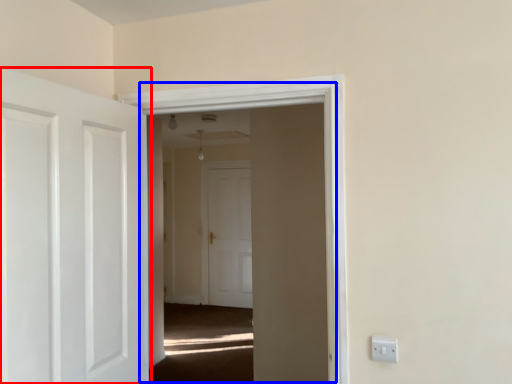
Question: Among these objects, which one is farthest to the camera, door (highlighted by a red box) or window (highlighted by a blue box)?

Choices:
 (A) door
 (B) window

Answer: (B)